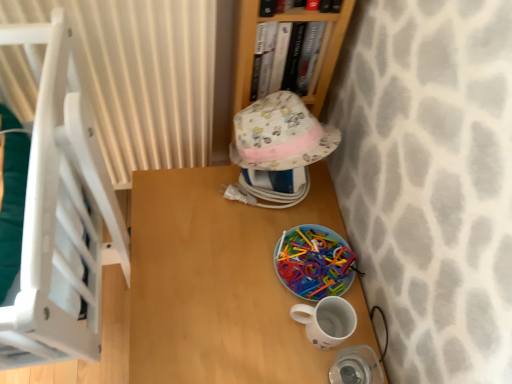
What are the coordinates of `vacant space positioned to the left of fluffy cotton hat at center` in the screenshot? It's located at (187, 192).